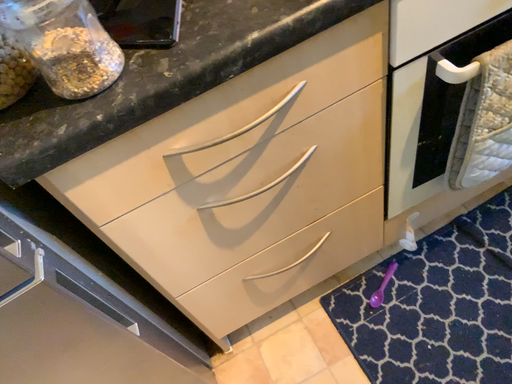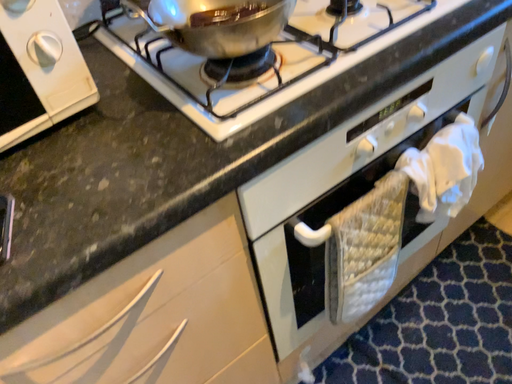
Question: Which way did the camera rotate in the video?

Choices:
 (A) rotated right
 (B) rotated left

Answer: (A)